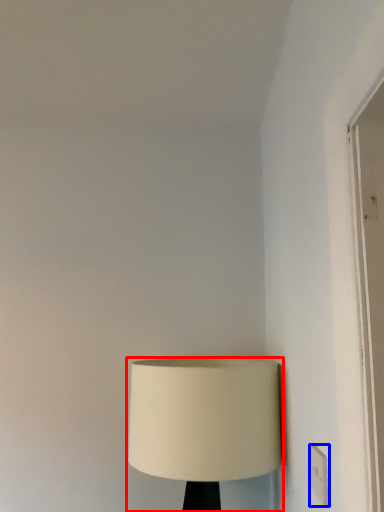
Question: Which object appears farthest to the camera in this image, lamp (highlighted by a red box) or electric outlet (highlighted by a blue box)?

Choices:
 (A) lamp
 (B) electric outlet

Answer: (A)